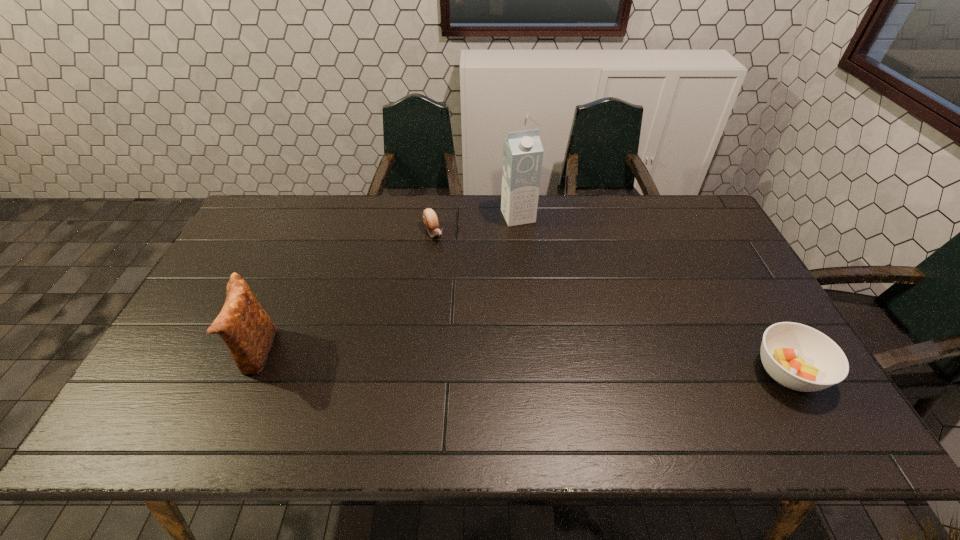
Locate an element on the screen. Image resolution: width=960 pixels, height=540 pixels. free spot on the desktop that is between the leftmost object and the rightmost object and is positioned on the front label of the carton is located at coordinates (592, 366).

Find the location of a particular element. The height and width of the screenshot is (540, 960). vacant spot on the desktop that is between the third shortest object and the soup bowl and is positioned on the front-facing side of the shortest object is located at coordinates (521, 363).